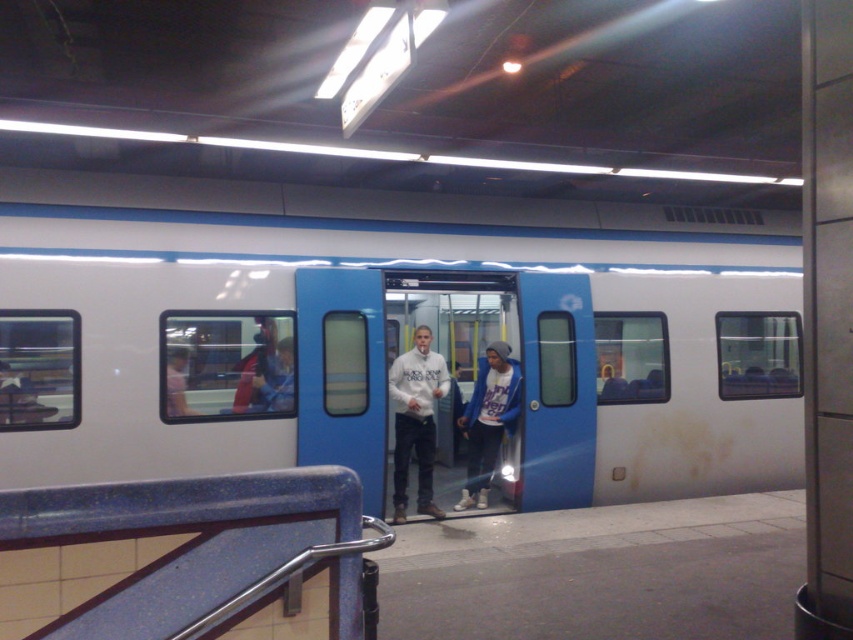
You are a fashion designer observing two hoodies at a subway station. The scene includes a train with open doors and passengers. The platform has a tiled floor and a metal handrail. You see the white matte hoodie at center and the white cotton hoodie at center. Which hoodie is bigger?

The white matte hoodie at center is larger in size compared to the white cotton hoodie at center.